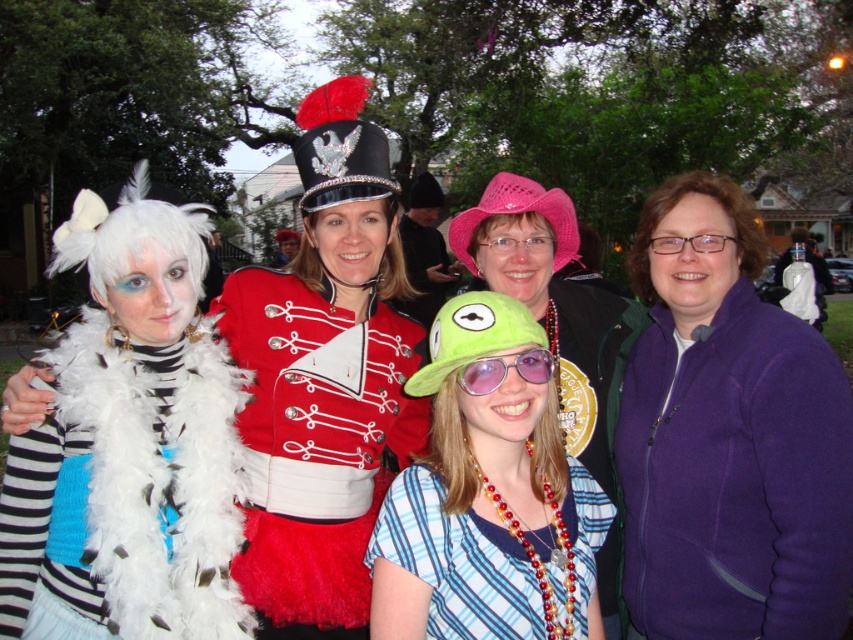
Question: Which of the following is the closest to the observer?

Choices:
 (A) (751, 337)
 (B) (155, 420)
 (C) (587, 522)

Answer: (B)

Question: Is white feather boa at left further to camera compared to red velvet jacket at center?

Choices:
 (A) yes
 (B) no

Answer: (B)

Question: Estimate the real-world distances between objects in this image. Which object is closer to the green felt hat at center?

Choices:
 (A) pink knitted hat at center
 (B) red velvet jacket at center
 (C) shiny red uniform at center

Answer: (A)

Question: Is shiny red uniform at center thinner than pink knitted hat at center?

Choices:
 (A) no
 (B) yes

Answer: (B)

Question: Does white feather boa at left have a greater width compared to green matte/glossy goggles at center?

Choices:
 (A) no
 (B) yes

Answer: (B)

Question: Which point is farther to the camera?

Choices:
 (A) (x=527, y=353)
 (B) (x=519, y=492)
 (C) (x=364, y=243)
 (D) (x=99, y=611)

Answer: (C)